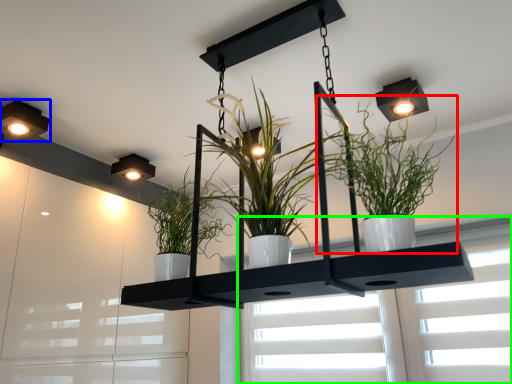
Question: Based on their relative distances, which object is farther from houseplant (highlighted by a red box)? Choose from lamp (highlighted by a blue box) and window (highlighted by a green box).

Choices:
 (A) lamp
 (B) window

Answer: (A)